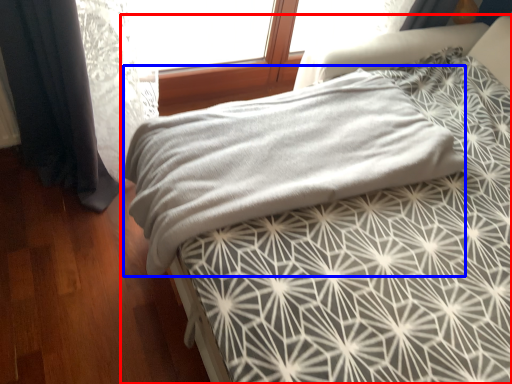
Question: Which object is closer to the camera taking this photo, bed (highlighted by a red box) or blanket (highlighted by a blue box)?

Choices:
 (A) bed
 (B) blanket

Answer: (A)